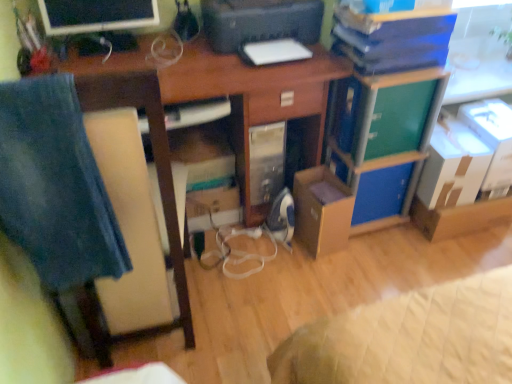
Image resolution: width=512 pixels, height=384 pixels. Find the location of `free space in front of brown cardboard box at lower right, which is the 3th cardboard box in left-to-right order`. free space in front of brown cardboard box at lower right, which is the 3th cardboard box in left-to-right order is located at coordinates (457, 256).